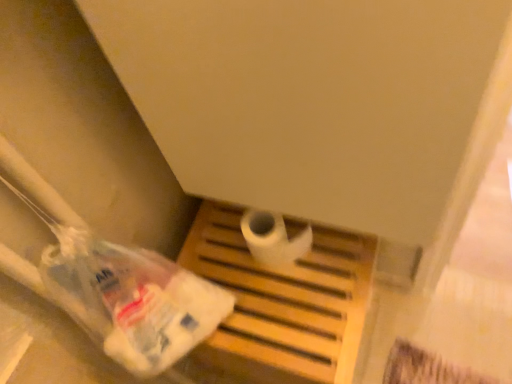
In order to face wooden tray at center, should I rotate leftwards or rightwards?

You should look right and rotate roughly 3.170 degrees.

What do you see at coordinates (132, 300) in the screenshot?
I see `translucent plastic bag at lower left` at bounding box center [132, 300].

Where is `white matte toilet paper at center`? white matte toilet paper at center is located at coordinates (273, 238).

Find the location of a particular element. wooden tray at center is located at coordinates (284, 300).

Does wooden tray at center contain white matte toilet paper at center?

No.

Which is nearer, (x=253, y=282) or (x=252, y=215)?

The point (x=252, y=215) is more forward.

Between wooden tray at center and white matte toilet paper at center, which one has larger size?

wooden tray at center is bigger.

Are translucent plastic bag at lower left and white matte toilet paper at center beside each other?

translucent plastic bag at lower left is not next to white matte toilet paper at center, and they're not touching.

From a real-world perspective, between translucent plastic bag at lower left and white matte toilet paper at center, who is vertically higher?

translucent plastic bag at lower left.

Is translucent plastic bag at lower left bigger than white matte toilet paper at center?

Correct, translucent plastic bag at lower left is larger in size than white matte toilet paper at center.

Considering the sizes of objects white matte toilet paper at center and wooden tray at center in the image provided, who is shorter, white matte toilet paper at center or wooden tray at center?

Standing shorter between the two is white matte toilet paper at center.

Locate an element on the screen. The image size is (512, 384). furniture that is on the right side of white matte toilet paper at center is located at coordinates (284, 300).

Considering the relative sizes of white matte toilet paper at center and wooden tray at center in the image provided, is white matte toilet paper at center smaller than wooden tray at center?

Indeed, white matte toilet paper at center has a smaller size compared to wooden tray at center.

Is white matte toilet paper at center not close to wooden tray at center?

No, white matte toilet paper at center is not far from wooden tray at center.

From the image's perspective, is wooden tray at center located above translucent plastic bag at lower left?

No, from the image's perspective, wooden tray at center is not on top of translucent plastic bag at lower left.

Considering the sizes of objects wooden tray at center and translucent plastic bag at lower left in the image provided, who is shorter, wooden tray at center or translucent plastic bag at lower left?

translucent plastic bag at lower left is shorter.

Could you tell me if wooden tray at center is facing translucent plastic bag at lower left?

No, wooden tray at center does not turn towards translucent plastic bag at lower left.

Visually, is wooden tray at center positioned to the left or to the right of translucent plastic bag at lower left?

Based on their positions, wooden tray at center is located to the right of translucent plastic bag at lower left.

Between point (125, 365) and point (262, 311), which one is positioned in front?

Point (125, 365)

In terms of width, does translucent plastic bag at lower left look wider or thinner when compared to wooden tray at center?

In the image, translucent plastic bag at lower left appears to be more narrow than wooden tray at center.

Looking at this image, considering the relative positions of translucent plastic bag at lower left and wooden tray at center in the image provided, is translucent plastic bag at lower left to the left of wooden tray at center from the viewer's perspective?

Correct, you'll find translucent plastic bag at lower left to the left of wooden tray at center.

Who is bigger, translucent plastic bag at lower left or wooden tray at center?

Bigger between the two is wooden tray at center.

Consider the image. Considering the relative sizes of white matte toilet paper at center and translucent plastic bag at lower left in the image provided, is white matte toilet paper at center taller than translucent plastic bag at lower left?

In fact, white matte toilet paper at center may be shorter than translucent plastic bag at lower left.

Can you confirm if white matte toilet paper at center is bigger than translucent plastic bag at lower left?

Incorrect, white matte toilet paper at center is not larger than translucent plastic bag at lower left.

Is white matte toilet paper at center looking in the opposite direction of translucent plastic bag at lower left?

white matte toilet paper at center does not have its back to translucent plastic bag at lower left.

Identify the location of toilet paper on the left of wooden tray at center. click(273, 238).

Where is `plastic bag in front of the white matte toilet paper at center`? Image resolution: width=512 pixels, height=384 pixels. plastic bag in front of the white matte toilet paper at center is located at coordinates (132, 300).

From the picture: Based on their spatial positions, is translucent plastic bag at lower left or wooden tray at center further from white matte toilet paper at center?

translucent plastic bag at lower left is positioned further to the anchor white matte toilet paper at center.

Looking at the image, which one is located further to translucent plastic bag at lower left, wooden tray at center or white matte toilet paper at center?

Based on the image, white matte toilet paper at center appears to be further to translucent plastic bag at lower left.

Which object lies nearer to the anchor point translucent plastic bag at lower left, white matte toilet paper at center or wooden tray at center?

wooden tray at center is positioned closer to the anchor translucent plastic bag at lower left.

From the image, which object appears to be nearer to wooden tray at center, translucent plastic bag at lower left or white matte toilet paper at center?

white matte toilet paper at center lies closer to wooden tray at center than the other object.

Estimate the real-world distances between objects in this image. Which object is closer to wooden tray at center, white matte toilet paper at center or translucent plastic bag at lower left?

white matte toilet paper at center lies closer to wooden tray at center than the other object.

Looking at the image, which one is located further to white matte toilet paper at center, wooden tray at center or translucent plastic bag at lower left?

The object further to white matte toilet paper at center is translucent plastic bag at lower left.

Identify the location of toilet paper between translucent plastic bag at lower left and wooden tray at center in the front-back direction. Image resolution: width=512 pixels, height=384 pixels. (273, 238).